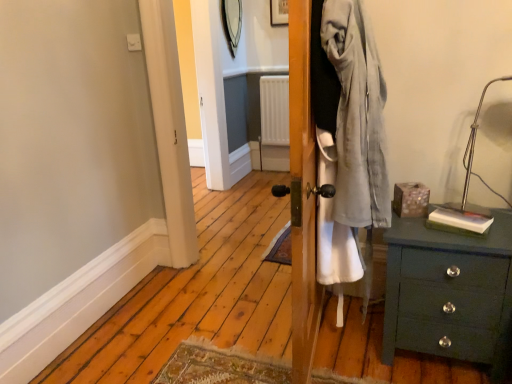
Question: Does wooden picture frame at upper center have a larger size compared to metallic silver table lamp at upper right?

Choices:
 (A) no
 (B) yes

Answer: (A)

Question: Is wooden picture frame at upper center oriented towards metallic silver table lamp at upper right?

Choices:
 (A) no
 (B) yes

Answer: (A)

Question: From the image's perspective, would you say wooden picture frame at upper center is positioned over metallic silver table lamp at upper right?

Choices:
 (A) yes
 (B) no

Answer: (A)

Question: From the image's perspective, does wooden picture frame at upper center appear lower than metallic silver table lamp at upper right?

Choices:
 (A) no
 (B) yes

Answer: (A)

Question: Is wooden picture frame at upper center at the right side of metallic silver table lamp at upper right?

Choices:
 (A) yes
 (B) no

Answer: (B)

Question: Considering the relative positions of wooden picture frame at upper center and metallic silver table lamp at upper right in the image provided, is wooden picture frame at upper center to the left of metallic silver table lamp at upper right from the viewer's perspective?

Choices:
 (A) no
 (B) yes

Answer: (B)

Question: Can you confirm if metallic silver table lamp at upper right is shorter than wooden picture frame at upper center?

Choices:
 (A) no
 (B) yes

Answer: (A)

Question: Is metallic silver table lamp at upper right positioned beyond the bounds of wooden picture frame at upper center?

Choices:
 (A) yes
 (B) no

Answer: (A)

Question: Could you tell me if metallic silver table lamp at upper right is facing wooden picture frame at upper center?

Choices:
 (A) yes
 (B) no

Answer: (B)

Question: From the image's perspective, would you say metallic silver table lamp at upper right is shown under wooden picture frame at upper center?

Choices:
 (A) yes
 (B) no

Answer: (A)

Question: Would you say metallic silver table lamp at upper right contains wooden picture frame at upper center?

Choices:
 (A) no
 (B) yes

Answer: (A)

Question: Does metallic silver table lamp at upper right have a larger size compared to wooden picture frame at upper center?

Choices:
 (A) yes
 (B) no

Answer: (A)

Question: Considering the relative positions of green wood chest of drawers at lower right and wooden picture frame at upper center in the image provided, is green wood chest of drawers at lower right behind wooden picture frame at upper center?

Choices:
 (A) yes
 (B) no

Answer: (B)